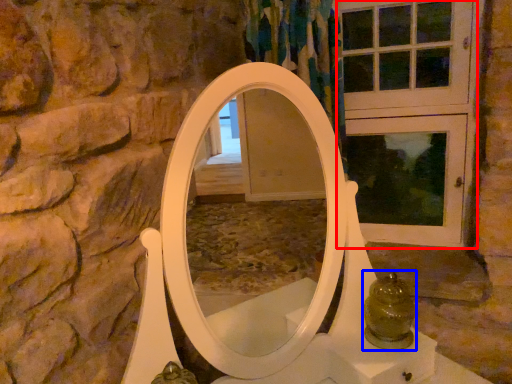
Question: Which of the following is the closest to the observer, screen door (highlighted by a red box) or glass jar (highlighted by a blue box)?

Choices:
 (A) screen door
 (B) glass jar

Answer: (B)